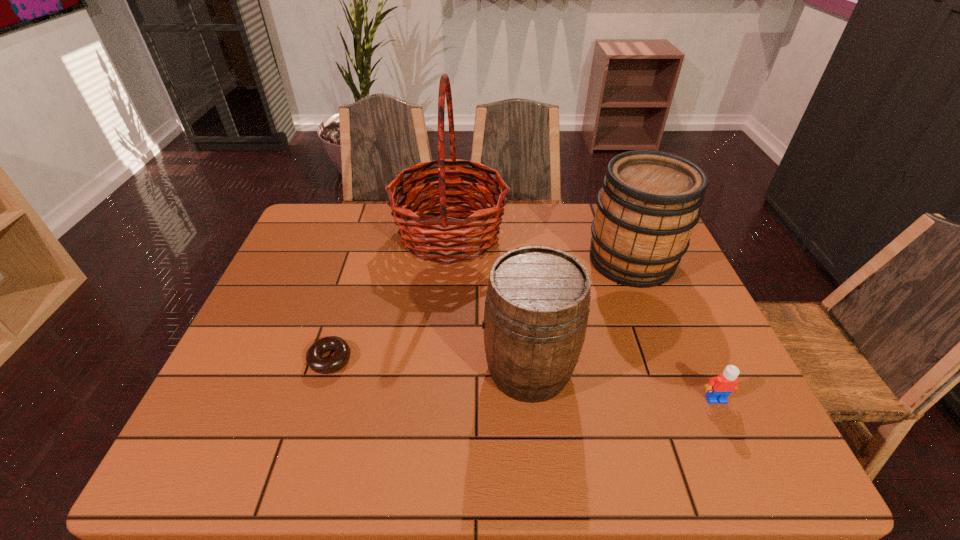
At what (x,y) coordinates should I click in order to perform the action: click on free space located 0.370m on the side of the left cider near the bung hole. Please return your answer as a coordinate pair (x, y). Image resolution: width=960 pixels, height=540 pixels. Looking at the image, I should click on (319, 369).

Image resolution: width=960 pixels, height=540 pixels. In order to click on free region located on the face of the Lego in this screenshot , I will do (x=736, y=444).

This screenshot has width=960, height=540. I want to click on vacant space located 0.210m on the right of the doughnut, so click(442, 360).

Identify the location of basket that is at the far edge. The height and width of the screenshot is (540, 960). (445, 244).

Locate an element on the screen. cider that is at the far edge is located at coordinates (650, 201).

The image size is (960, 540). I want to click on cider present at the right edge, so click(650, 201).

At what (x,y) coordinates should I click in order to perform the action: click on Lego present at the right edge. Please return your answer as a coordinate pair (x, y). Looking at the image, I should click on (x=718, y=389).

The width and height of the screenshot is (960, 540). In order to click on object that is at the far right corner in this screenshot , I will do pos(650,201).

Locate an element on the screen. This screenshot has width=960, height=540. blank space at the far edge of the desktop is located at coordinates (514, 232).

In the image, there is a desktop. Where is `vacant space at the near edge`? vacant space at the near edge is located at coordinates point(334,463).